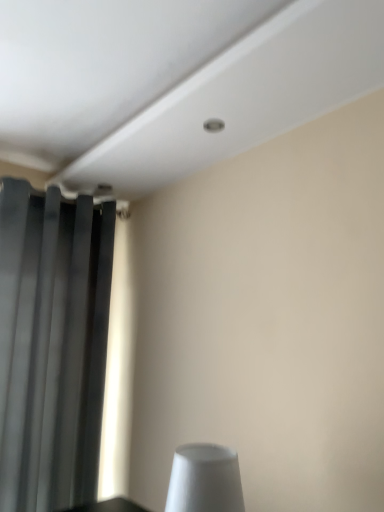
In order to click on dark gray matte curtain at left in this screenshot , I will do `click(52, 345)`.

What is the approximate width of dark gray matte curtain at left?

It is 19.58 centimeters.

Describe the element at coordinates (52, 345) in the screenshot. This screenshot has width=384, height=512. I see `dark gray matte curtain at left` at that location.

The width and height of the screenshot is (384, 512). Describe the element at coordinates (205, 480) in the screenshot. I see `white matte cone at lower center` at that location.

At what (x,y) coordinates should I click in order to perform the action: click on white matte cone at lower center. Please return your answer as a coordinate pair (x, y). This screenshot has height=512, width=384. Looking at the image, I should click on (205, 480).

Measure the distance between point (171, 496) and camera.

The depth of point (171, 496) is 3.58 feet.

Identify the location of dark gray matte curtain at left. (52, 345).

Visually, is dark gray matte curtain at left positioned to the left or to the right of white matte cone at lower center?

In the image, dark gray matte curtain at left appears on the left side of white matte cone at lower center.

Is the depth of dark gray matte curtain at left greater than that of white matte cone at lower center?

That is True.

Is point (15, 504) positioned after point (181, 450)?

Yes, it is.

From the image's perspective, who appears lower, dark gray matte curtain at left or white matte cone at lower center?

white matte cone at lower center is shown below in the image.

From a real-world perspective, is dark gray matte curtain at left above or below white matte cone at lower center?

In terms of real-world spatial position, dark gray matte curtain at left is above white matte cone at lower center.

Between dark gray matte curtain at left and white matte cone at lower center, which one has smaller width?

Thinner between the two is dark gray matte curtain at left.

In the scene shown: Which of these two, dark gray matte curtain at left or white matte cone at lower center, stands taller?

Standing taller between the two is dark gray matte curtain at left.

Does dark gray matte curtain at left have a larger size compared to white matte cone at lower center?

Yes.

Is dark gray matte curtain at left outside of white matte cone at lower center?

Yes.

Is dark gray matte curtain at left positioned far away from white matte cone at lower center?

That's right, there is a large distance between dark gray matte curtain at left and white matte cone at lower center.

Is white matte cone at lower center at the back of dark gray matte curtain at left?

That's not correct — dark gray matte curtain at left is not looking away from white matte cone at lower center.

Can you tell me how much dark gray matte curtain at left and white matte cone at lower center differ in facing direction?

dark gray matte curtain at left and white matte cone at lower center are facing 86.9 degrees away from each other.

How much distance is there between dark gray matte curtain at left and white matte cone at lower center?

dark gray matte curtain at left is 1.07 meters away from white matte cone at lower center.

You are a GUI agent. You are given a task and a screenshot of the screen. Output one action in this format:
    pyautogui.click(x=<x>, y=<y>)
    Task: Click on the table lamp that appears below the dark gray matte curtain at left (from the image's perspective)
    This screenshot has height=512, width=384.
    Given the screenshot: What is the action you would take?
    pyautogui.click(x=205, y=480)

Is white matte cone at lower center to the left of dark gray matte curtain at left from the viewer's perspective?

No.

Which object is further away from the camera, white matte cone at lower center or dark gray matte curtain at left?

dark gray matte curtain at left is further away from the camera.

Is point (226, 477) closer to camera compared to point (52, 294)?

Yes, point (226, 477) is closer to viewer.

Consider the image. From the image's perspective, is white matte cone at lower center below dark gray matte curtain at left?

Yes.

From a real-world perspective, between white matte cone at lower center and dark gray matte curtain at left, who is vertically lower?

white matte cone at lower center.

Can you confirm if white matte cone at lower center is wider than dark gray matte curtain at left?

Yes, white matte cone at lower center is wider than dark gray matte curtain at left.

Considering the relative sizes of white matte cone at lower center and dark gray matte curtain at left in the image provided, is white matte cone at lower center shorter than dark gray matte curtain at left?

Correct, white matte cone at lower center is not as tall as dark gray matte curtain at left.

Between white matte cone at lower center and dark gray matte curtain at left, which one has larger size?

Bigger between the two is dark gray matte curtain at left.

Is white matte cone at lower center positioned beyond the bounds of dark gray matte curtain at left?

white matte cone at lower center lies outside dark gray matte curtain at left's area.

Is white matte cone at lower center far from dark gray matte curtain at left?

Absolutely, white matte cone at lower center is distant from dark gray matte curtain at left.

Does white matte cone at lower center turn towards dark gray matte curtain at left?

No, white matte cone at lower center is not turned towards dark gray matte curtain at left.

How many degrees apart are the facing directions of white matte cone at lower center and dark gray matte curtain at left?

86.9 degrees.

Locate an element on the screen. The image size is (384, 512). curtain located above the white matte cone at lower center (from a real-world perspective) is located at coordinates (52, 345).

This screenshot has width=384, height=512. I want to click on curtain that appears behind the white matte cone at lower center, so click(x=52, y=345).

In the image, there is a dark gray matte curtain at left. Identify the location of table lamp below it (from a real-world perspective). (205, 480).